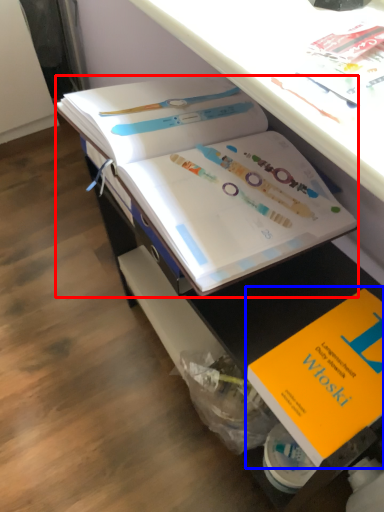
Question: Which object is closer to the camera taking this photo, book (highlighted by a red box) or book (highlighted by a blue box)?

Choices:
 (A) book
 (B) book

Answer: (B)